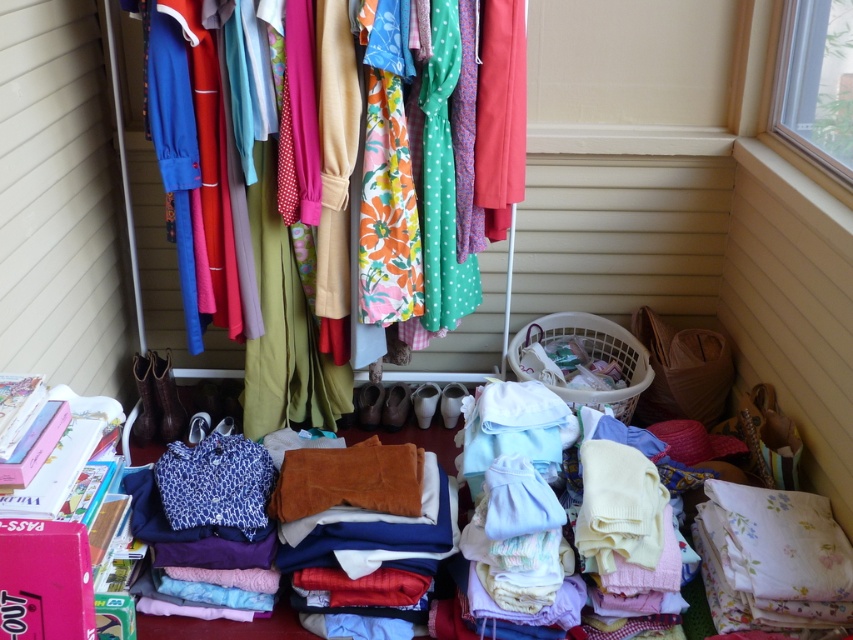
Locate an element on the screen. matte fabric clothes at center is located at coordinates (149, 244).

Looking at this image, can you confirm if matte fabric clothes at center is bigger than white plastic laundry basket at lower center?

Indeed, matte fabric clothes at center has a larger size compared to white plastic laundry basket at lower center.

Where is `matte fabric clothes at center`? This screenshot has width=853, height=640. matte fabric clothes at center is located at coordinates (149, 244).